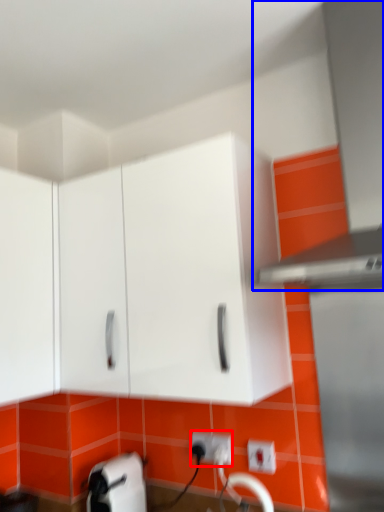
Question: Which of the following is the closest to the observer, electric outlet (highlighted by a red box) or exhaust hood (highlighted by a blue box)?

Choices:
 (A) electric outlet
 (B) exhaust hood

Answer: (B)